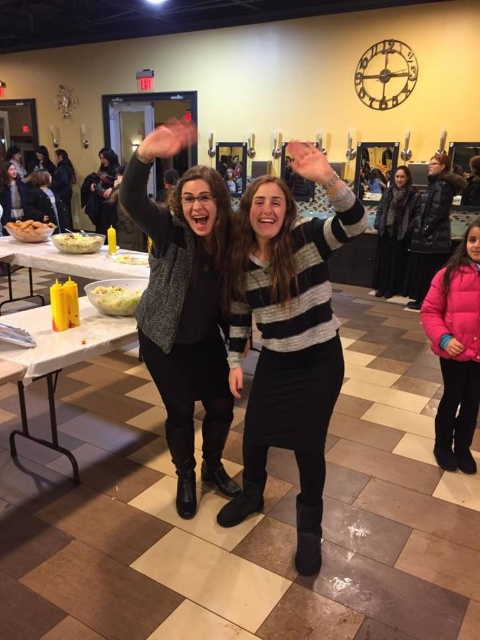
You are a guest at this event and want to choose the taller salad between the white creamy salad at center and the white creamy salad at left. Which one should you pick?

The white creamy salad at center is taller than the white creamy salad at left, so you should pick the white creamy salad at center.

You are a photographer standing at the entrance of the room. You want to take a photo of both the white creamy salad at center and the white creamy salad at left. How far apart are these two salads from each other?

The white creamy salad at center is 5.10 feet away from the white creamy salad at left.